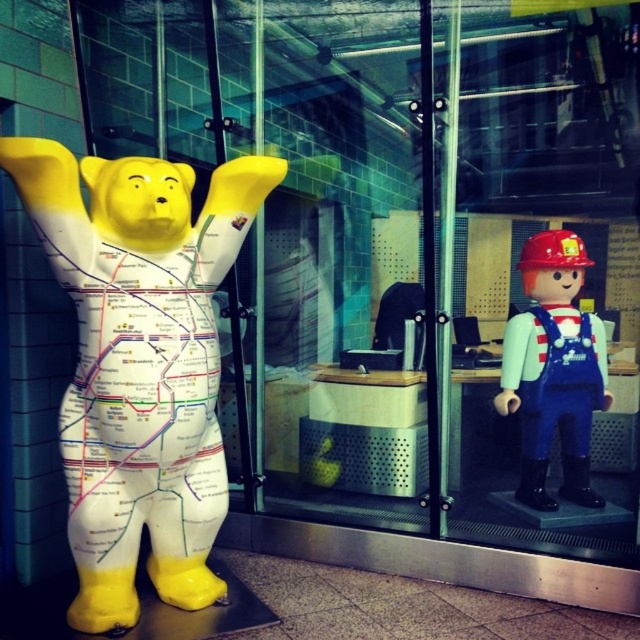
Question: Which point appears farthest from the camera in this image?

Choices:
 (A) (596, 333)
 (B) (112, 429)

Answer: (A)

Question: Is yellow matte bear at left bigger than matte blue overalls at right?

Choices:
 (A) no
 (B) yes

Answer: (B)

Question: Among these objects, which one is nearest to the camera?

Choices:
 (A) yellow matte bear at left
 (B) matte blue overalls at right

Answer: (A)

Question: Is yellow matte bear at left bigger than matte blue overalls at right?

Choices:
 (A) no
 (B) yes

Answer: (B)

Question: Does yellow matte bear at left appear on the right side of matte blue overalls at right?

Choices:
 (A) yes
 (B) no

Answer: (B)

Question: Which point is farther to the camera?

Choices:
 (A) matte blue overalls at right
 (B) yellow matte bear at left

Answer: (A)